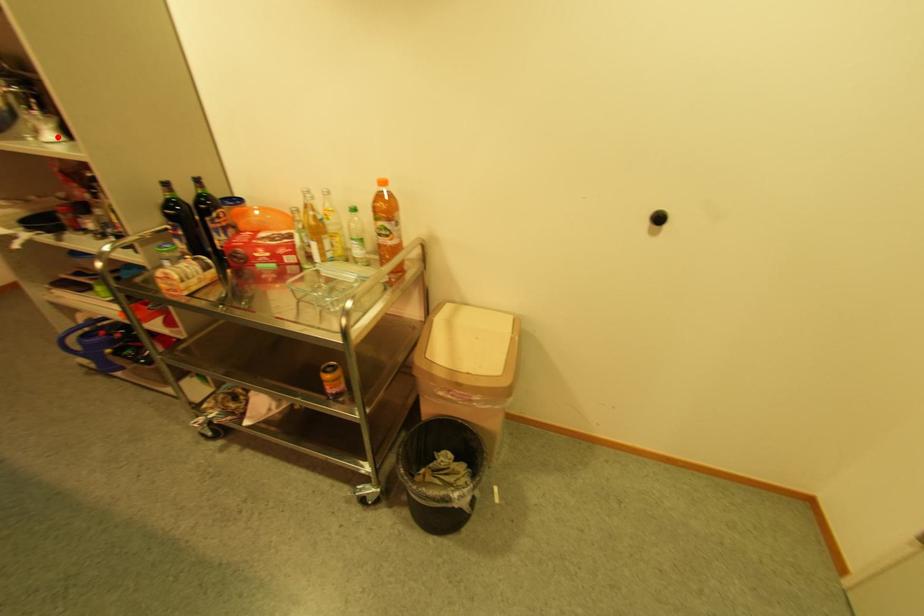
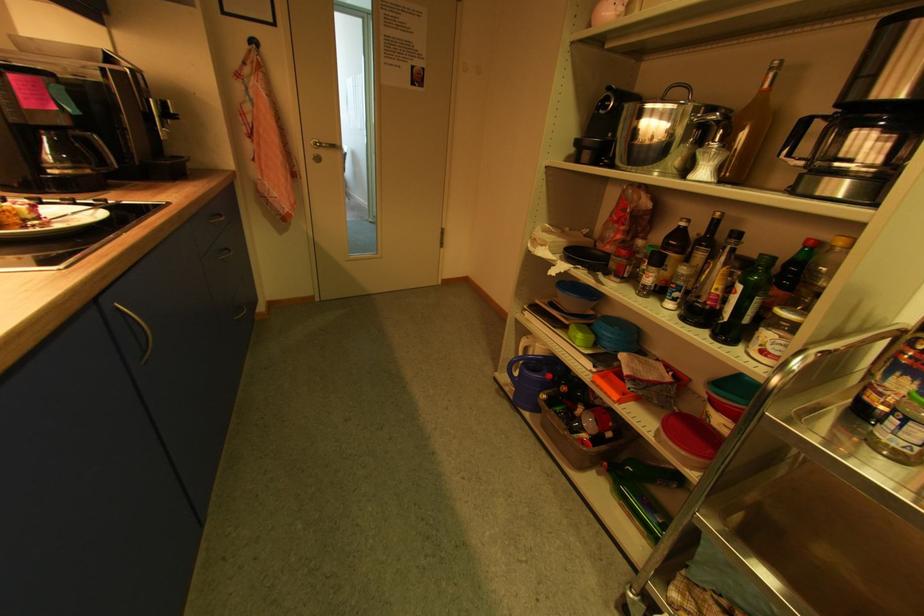
Question: I am providing you with two images of the same scene from different viewpoints. Given a red point in image1, look at the same physical point in image2. Is it:

Choices:
 (A) Closer to the viewpoint
 (B) Farther from the viewpoint

Answer: (A)